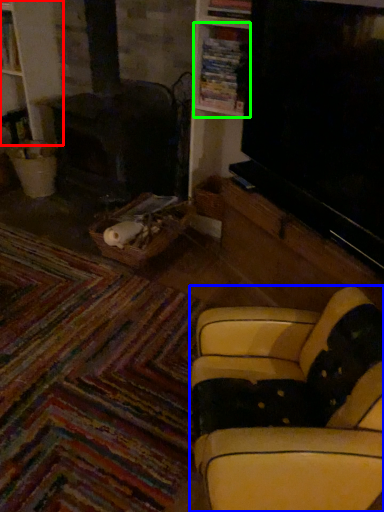
Question: Based on their relative distances, which object is nearer to bookshelf (highlighted by a red box)? Choose from studio couch (highlighted by a blue box) and shelf (highlighted by a green box).

Choices:
 (A) studio couch
 (B) shelf

Answer: (B)